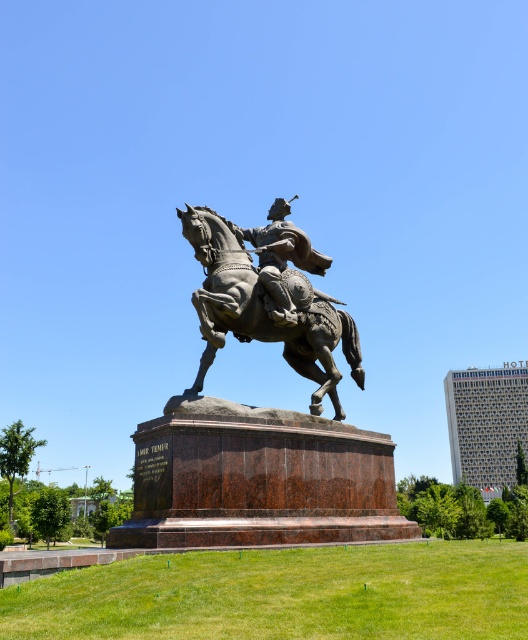
You are a sculptor who wants to place a small plaque between the bronze textured horse at center and the bronze helmet at center. The plaque is 3 feet wide. Is there enough space between them to fit the plaque?

The distance between the bronze textured horse at center and the bronze helmet at center is 5.53 feet. Since the plaque is 3 feet wide, there is enough space to fit it between them.

You are standing at the base of the statue and want to touch the point at coordinates [259,429] on the bronze statue at center. Is this point on the statue itself or the pedestal?

The point at coordinates [259,429] is on the bronze statue at center, so yes, it is on the statue itself and not the pedestal.

You are an art student analyzing the statue from the front. You notice the bronze textured horse at center and the bronze helmet at center. Which object is positioned to the left?

The bronze textured horse at center is positioned to the left of the bronze helmet at center.